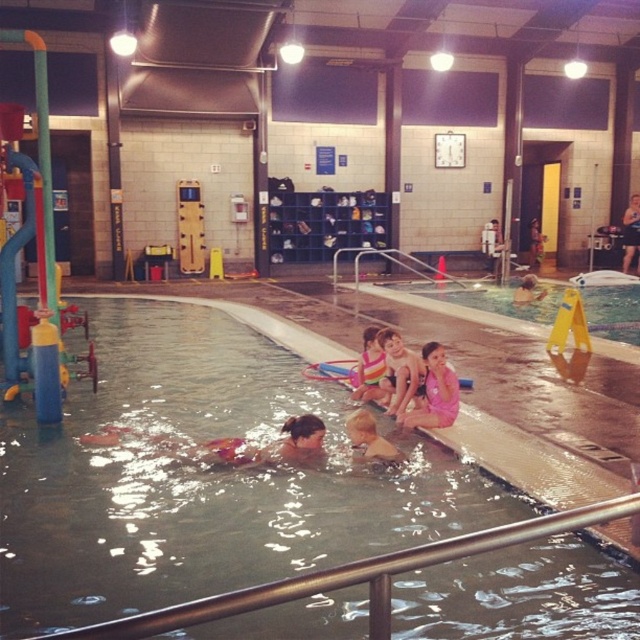
Is pink fabric swimsuit at lower right closer to camera compared to striped fabric swimsuit at center?

Yes, it is in front of striped fabric swimsuit at center.

Does pink fabric swimsuit at lower right have a lesser width compared to striped fabric swimsuit at center?

In fact, pink fabric swimsuit at lower right might be wider than striped fabric swimsuit at center.

At what (x,y) coordinates should I click in order to perform the action: click on pink fabric swimsuit at lower right. Please return your answer as a coordinate pair (x, y). Image resolution: width=640 pixels, height=640 pixels. Looking at the image, I should click on (435, 392).

Where is `pink fabric swimsuit at lower right`? The height and width of the screenshot is (640, 640). pink fabric swimsuit at lower right is located at coordinates (435, 392).

Is clear plastic pool at center positioned at the back of pink fabric swimsuit at center?

Yes, it is.

Where is `clear plastic pool at center`? clear plastic pool at center is located at coordinates (486, 298).

How much distance is there between light brown skin at center and smooth blue swimmer at upper right?

A distance of 15.69 meters exists between light brown skin at center and smooth blue swimmer at upper right.

Does light brown skin at center appear over smooth blue swimmer at upper right?

Actually, light brown skin at center is below smooth blue swimmer at upper right.

What do you see at coordinates (369, 440) in the screenshot?
I see `light brown skin at center` at bounding box center [369, 440].

Where is `light brown skin at center`? light brown skin at center is located at coordinates (369, 440).